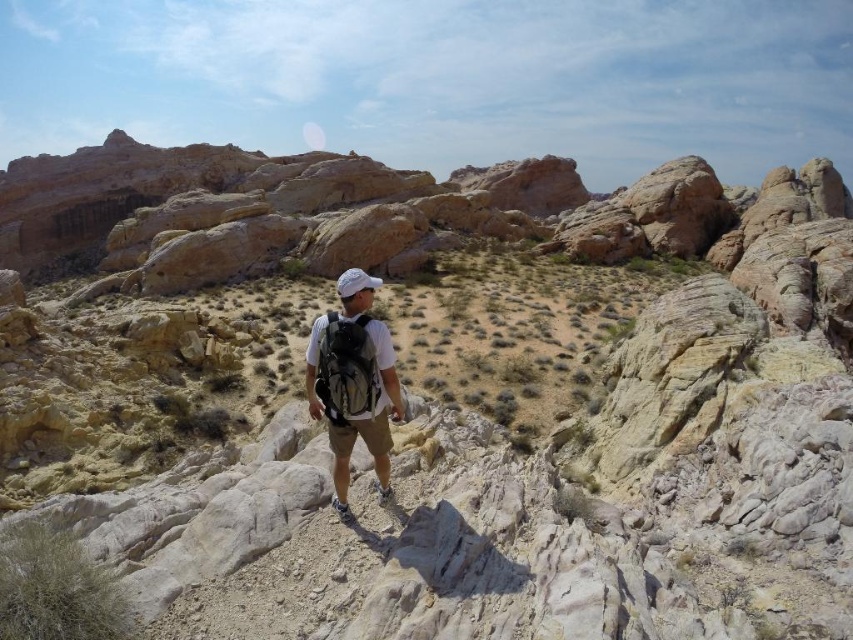
Question: Is white matte backpack at center positioned before matte gray backpack at center?

Choices:
 (A) yes
 (B) no

Answer: (B)

Question: Does white matte backpack at center appear on the left side of matte gray backpack at center?

Choices:
 (A) yes
 (B) no

Answer: (A)

Question: Which object appears farthest from the camera in this image?

Choices:
 (A) matte gray backpack at center
 (B) white matte backpack at center

Answer: (B)

Question: Is white matte backpack at center behind matte gray backpack at center?

Choices:
 (A) yes
 (B) no

Answer: (A)